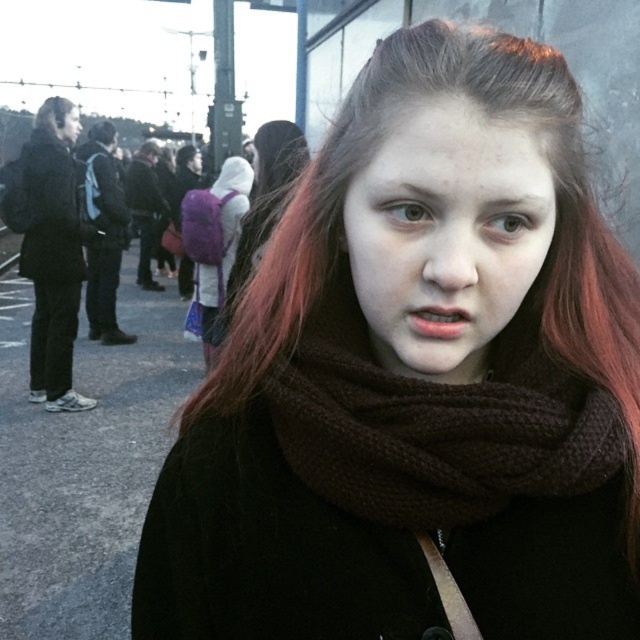
Question: Can you confirm if matte black backpack at left is positioned below brown woolen hair at upper left?

Choices:
 (A) yes
 (B) no

Answer: (A)

Question: Is brown knitted scarf at center further to camera compared to brown woolen hair at upper left?

Choices:
 (A) no
 (B) yes

Answer: (A)

Question: Which point is closer to the camera taking this photo?

Choices:
 (A) (280, 416)
 (B) (36, 116)
 (C) (125, 340)

Answer: (A)

Question: Which object appears farthest from the camera in this image?

Choices:
 (A) matte black backpack at left
 (B) matte black jacket at left
 (C) brown knitted scarf at center
 (D) brown woolen hair at upper left

Answer: (A)

Question: Is matte black jacket at left behind brown woolen hair at upper left?

Choices:
 (A) yes
 (B) no

Answer: (B)

Question: Which object is the closest to the matte black backpack at left?

Choices:
 (A) brown knitted scarf at center
 (B) matte black jacket at left

Answer: (B)